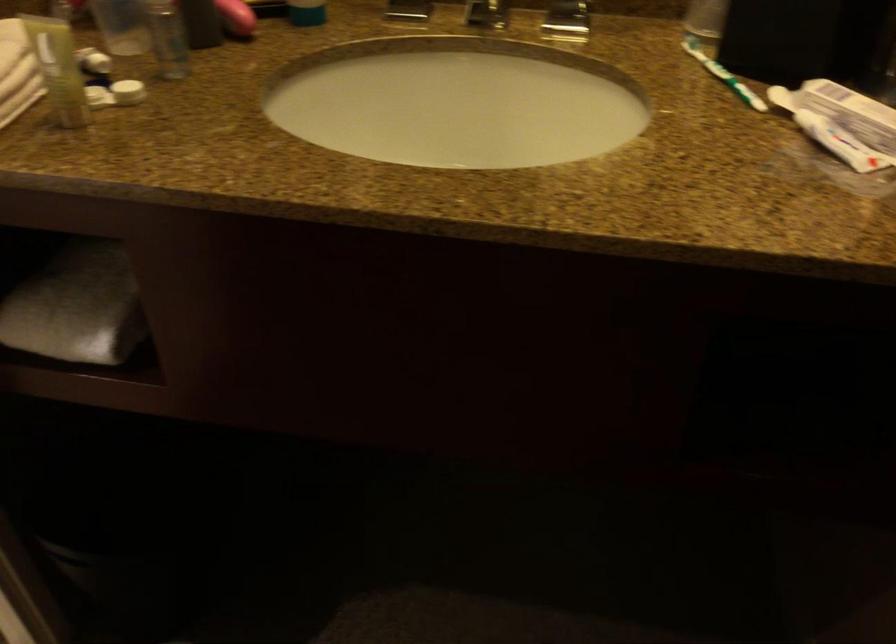
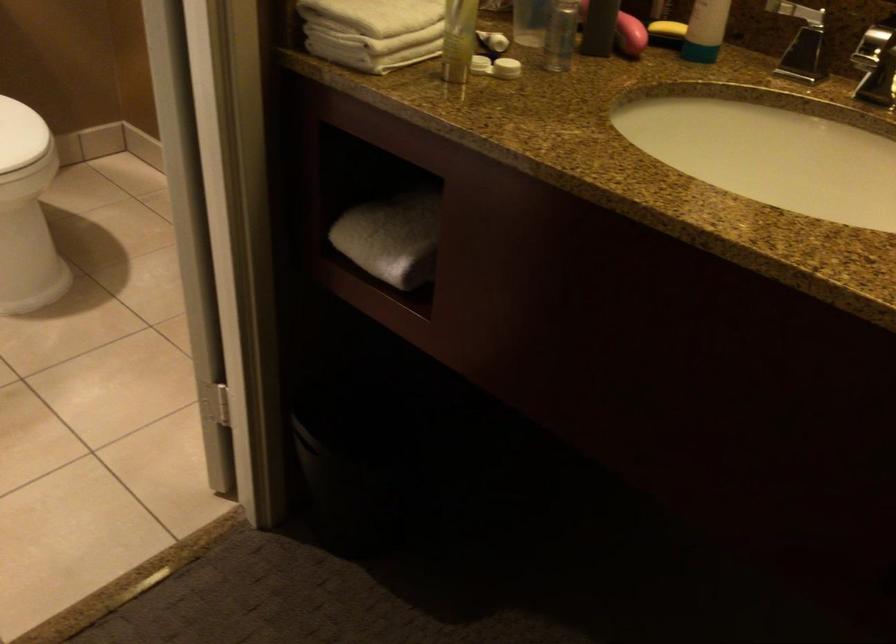
Find the pixel in the second image that matches (x=74, y=312) in the first image.

(392, 238)